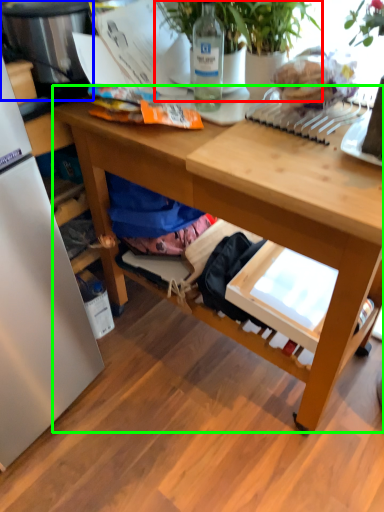
Question: Estimate the real-world distances between objects in this image. Which object is farther from houseplant (highlighted by a red box), appliance (highlighted by a blue box) or desk (highlighted by a green box)?

Choices:
 (A) appliance
 (B) desk

Answer: (B)